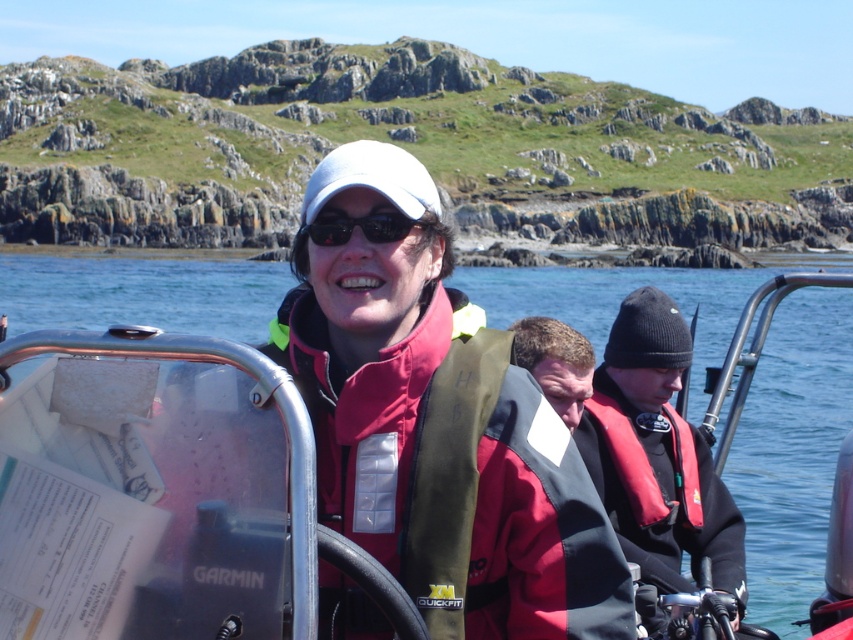
You are on a boat and need to retrieve the red life vest at center to check its safety. Which direction should you move from the red matte life jacket at right to reach it?

To reach the red life vest at center from the red matte life jacket at right, you should move downward since the red life vest at center is located below the red matte life jacket at right.

Based on the scene description, where is the red life vest at center located in terms of coordinates?

The red life vest at center is located at coordinates point (657, 454).

You are on a boat and need to take a photo of the red life vest at center. You have a camera that has a maximum range of 60 meters. Can you take the photo without moving closer?

The red life vest at center and the camera are 62.34 meters apart, which exceeds the camera maximum range of 60 meters. You cannot take the photo without moving closer.